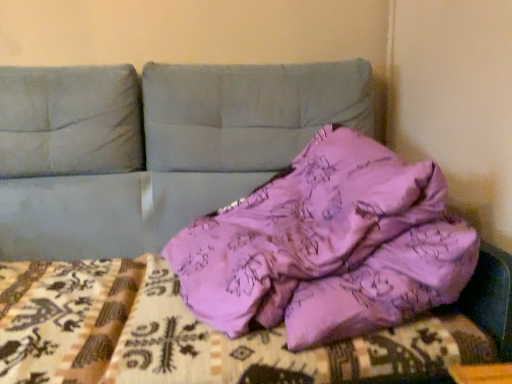
Question: Is pink fabric at center at the back of pink fabric pillow at center?

Choices:
 (A) no
 (B) yes

Answer: (A)

Question: From a real-world perspective, is pink fabric pillow at center physically below pink fabric at center?

Choices:
 (A) yes
 (B) no

Answer: (B)

Question: Is pink fabric pillow at center at the right side of pink fabric at center?

Choices:
 (A) yes
 (B) no

Answer: (A)

Question: Does pink fabric pillow at center have a greater height compared to pink fabric at center?

Choices:
 (A) yes
 (B) no

Answer: (A)

Question: Is pink fabric pillow at center not near pink fabric at center?

Choices:
 (A) yes
 (B) no

Answer: (B)

Question: Is pink fabric pillow at center located outside pink fabric at center?

Choices:
 (A) yes
 (B) no

Answer: (A)

Question: Is pink fabric at center positioned behind pink fabric pillow at center?

Choices:
 (A) no
 (B) yes

Answer: (B)

Question: Considering the relative sizes of pink fabric at center and pink fabric pillow at center in the image provided, is pink fabric at center smaller than pink fabric pillow at center?

Choices:
 (A) no
 (B) yes

Answer: (B)

Question: Does pink fabric at center have a lesser width compared to pink fabric pillow at center?

Choices:
 (A) yes
 (B) no

Answer: (A)

Question: Is pink fabric at center completely or partially outside of pink fabric pillow at center?

Choices:
 (A) yes
 (B) no

Answer: (B)

Question: From the image's perspective, does pink fabric at center appear higher than pink fabric pillow at center?

Choices:
 (A) yes
 (B) no

Answer: (B)

Question: Is pink fabric at center oriented away from pink fabric pillow at center?

Choices:
 (A) yes
 (B) no

Answer: (A)

Question: From the image's perspective, is pink fabric at center above or below pink fabric pillow at center?

Choices:
 (A) above
 (B) below

Answer: (B)